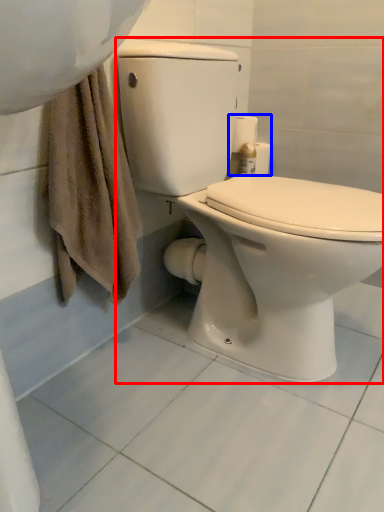
Question: Which object appears farthest to the camera in this image, toilet (highlighted by a red box) or toilet paper (highlighted by a blue box)?

Choices:
 (A) toilet
 (B) toilet paper

Answer: (B)